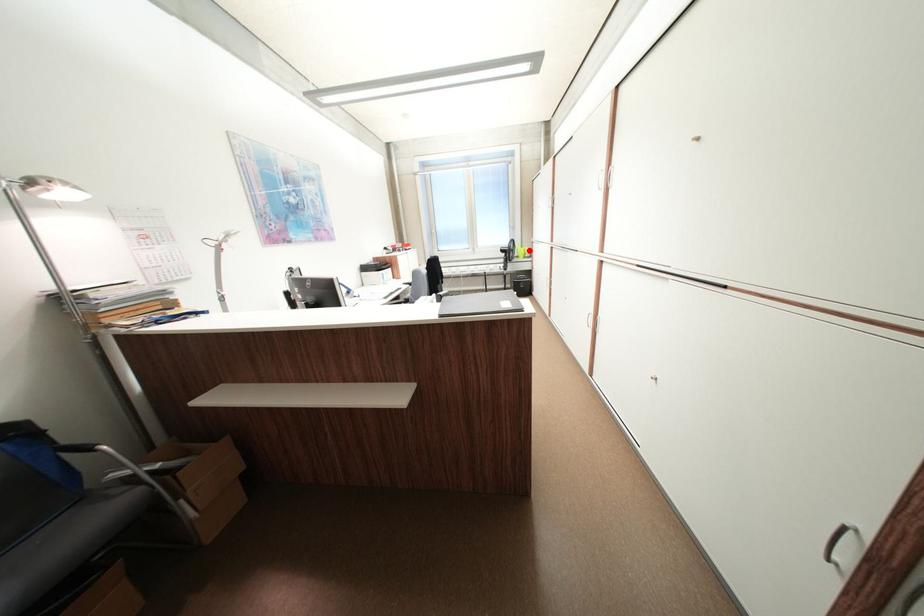
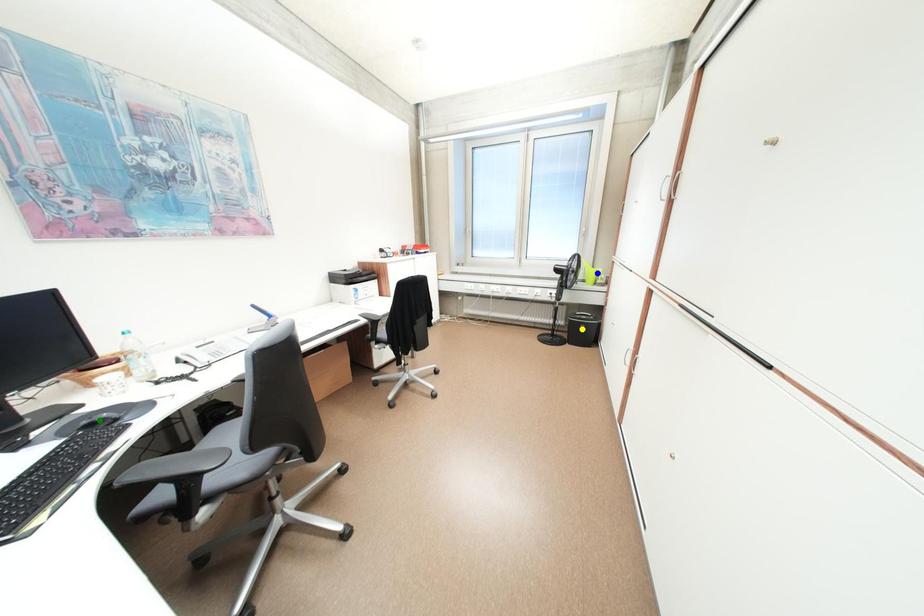
Question: I am providing you with two images of the same scene from different viewpoints. A red point is marked on the first image. You are given multiple points on the second image. Which point in image 2 represents the same 3d spot as the red point in image 1?

Choices:
 (A) blue point
 (B) green point
 (C) yellow point

Answer: (A)